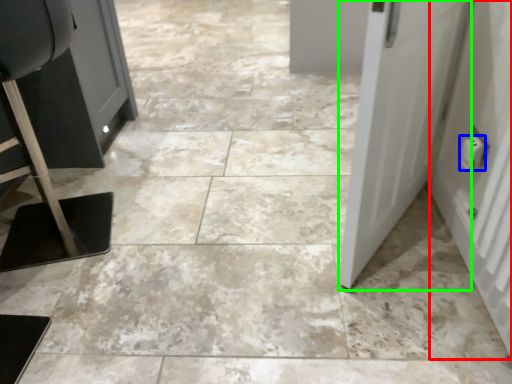
Question: Estimate the real-world distances between objects in this image. Which object is closer to door (highlighted by a red box), electric outlet (highlighted by a blue box) or door (highlighted by a green box)?

Choices:
 (A) electric outlet
 (B) door

Answer: (A)